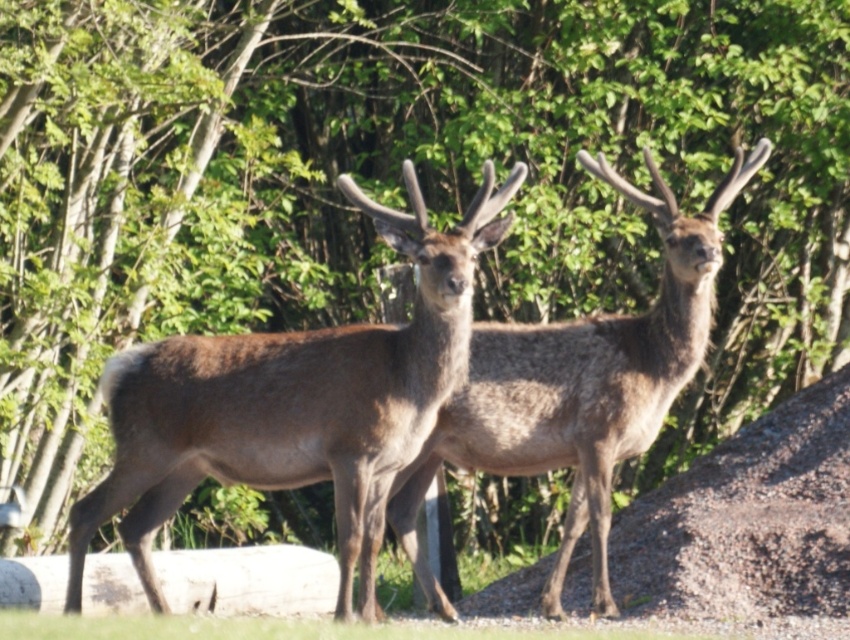
Between brown matte deer at center and brown fuzzy deer at center, which one appears on the left side from the viewer's perspective?

From the viewer's perspective, brown matte deer at center appears more on the left side.

Who is more distant from viewer, (128, 356) or (551, 336)?

Point (551, 336)

Does point (343, 515) come behind point (401, 484)?

That is False.

Find the location of a particular element. Image resolution: width=850 pixels, height=640 pixels. brown matte deer at center is located at coordinates (295, 401).